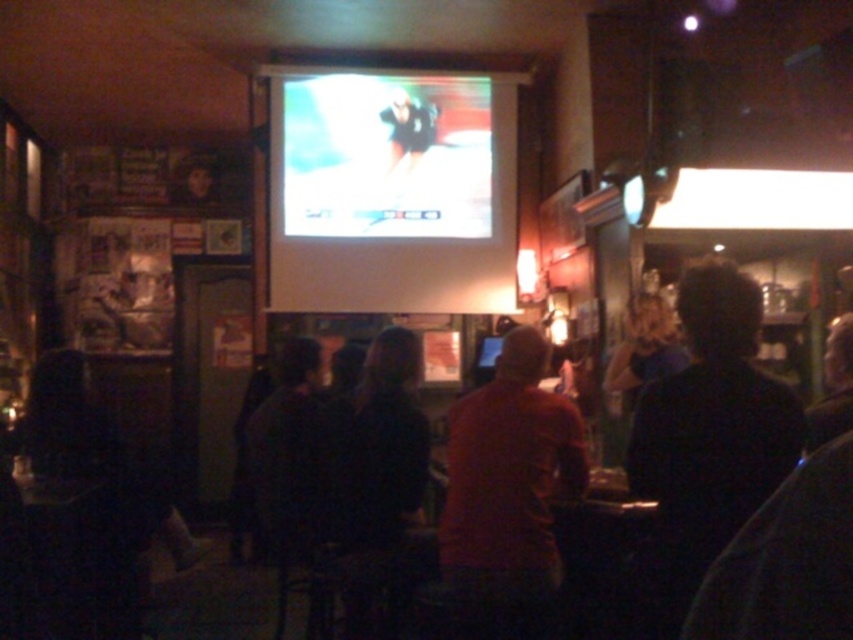
You are a guest at this event and want to take a photo of the red matte shirt at center without the matte plastic screen at upper center blocking it. How should you adjust your position?

Move your position downward so that the red matte shirt at center is no longer obscured by the matte plastic screen at upper center above it.

You are a photographer in this room and want to take a clear photo of the red matte shirt at center without the matte plastic screen at upper center blocking it. Can you move to a position where you can do this?

The red matte shirt at center is behind the matte plastic screen at upper center, so you cannot take a clear photo of the red matte shirt at center without the screen blocking it unless you move behind the screen or adjust your angle to avoid the screen.